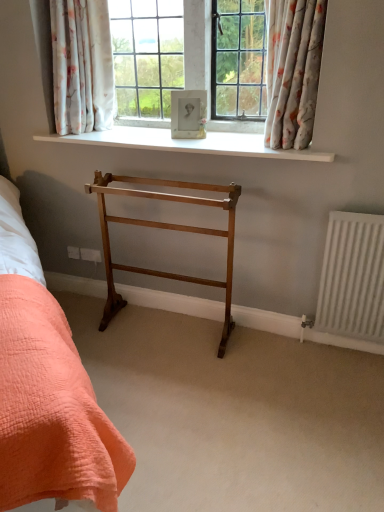
What do you see at coordinates (188, 114) in the screenshot? The width and height of the screenshot is (384, 512). I see `porcelain frame at center` at bounding box center [188, 114].

Locate an element on the screen. This screenshot has height=512, width=384. floral fabric curtain at upper center, positioned as the 2th curtain in right-to-left order is located at coordinates (82, 66).

What do you see at coordinates (168, 229) in the screenshot? This screenshot has height=512, width=384. I see `light brown wood towel rack at center` at bounding box center [168, 229].

The image size is (384, 512). I want to click on porcelain frame at center, so click(x=188, y=114).

At what (x,y) coordinates should I click in order to perform the action: click on picture frame lying above the light brown wood towel rack at center (from the image's perspective). Please return your answer as a coordinate pair (x, y). This screenshot has height=512, width=384. Looking at the image, I should click on (188, 114).

Is point (183, 185) closer to camera compared to point (202, 113)?

Yes, point (183, 185) is in front of point (202, 113).

Would you say light brown wood towel rack at center is inside or outside porcelain frame at center?

light brown wood towel rack at center lies outside porcelain frame at center.

From a real-world perspective, is light brown wood towel rack at center above or below porcelain frame at center?

Clearly, from a real-world perspective, light brown wood towel rack at center is below porcelain frame at center.

Where is `the 2nd curtain above the white matte radiator at right (from the image's perspective)`? The image size is (384, 512). the 2nd curtain above the white matte radiator at right (from the image's perspective) is located at coordinates (82, 66).

Is white matte radiator at right to the right of floral fabric curtain at upper center, positioned as the 2th curtain in right-to-left order, from the viewer's perspective?

Indeed, white matte radiator at right is positioned on the right side of floral fabric curtain at upper center, positioned as the 2th curtain in right-to-left order.

Is white matte radiator at right wider or thinner than floral fabric curtain at upper center, positioned as the 2th curtain in right-to-left order?

white matte radiator at right is thinner than floral fabric curtain at upper center, positioned as the 2th curtain in right-to-left order.

From a real-world perspective, which object stands above the other?

In real-world perspective, porcelain frame at center is above.

In terms of size, does porcelain frame at center appear bigger or smaller than light brown wood towel rack at center?

In the image, porcelain frame at center appears to be smaller than light brown wood towel rack at center.

Which is in front, point (203, 119) or point (98, 179)?

The point (98, 179) is closer to the camera.

Is porcelain frame at center positioned beyond the bounds of light brown wood towel rack at center?

Yes, porcelain frame at center is outside of light brown wood towel rack at center.

From the image's perspective, which object appears higher, light brown wood towel rack at center or white smooth window sill at upper center?

white smooth window sill at upper center appears higher in the image.

Is light brown wood towel rack at center touching white smooth window sill at upper center?

No, light brown wood towel rack at center is not with white smooth window sill at upper center.

Between light brown wood towel rack at center and white smooth window sill at upper center, which one has smaller width?

Thinner between the two is light brown wood towel rack at center.

Is light brown wood towel rack at center positioned beyond the bounds of white smooth window sill at upper center?

Absolutely, light brown wood towel rack at center is external to white smooth window sill at upper center.

Is floral fabric curtain at upper center, positioned as the 2th curtain in right-to-left order, positioned far away from white matte radiator at right?

Indeed, floral fabric curtain at upper center, positioned as the 2th curtain in right-to-left order, is not near white matte radiator at right.

Does floral fabric curtain at upper center, marked as the 1th curtain in a left-to-right arrangement, have a smaller size compared to white matte radiator at right?

No.

In order to click on curtain that is the 2nd object above the white matte radiator at right (from a real-world perspective) in this screenshot , I will do `click(82, 66)`.

Is floral fabric curtain at upper center, positioned as the 2th curtain in right-to-left order, positioned with its back to white matte radiator at right?

No, white matte radiator at right is not at the back of floral fabric curtain at upper center, positioned as the 2th curtain in right-to-left order.

Based on the photo, between light brown wood towel rack at center and floral fabric curtain at upper right, positioned as the 2th curtain in left-to-right order, which one is positioned in front?

floral fabric curtain at upper right, positioned as the 2th curtain in left-to-right order.

Considering the sizes of objects light brown wood towel rack at center and floral fabric curtain at upper right, which is the 1th curtain from right to left, in the image provided, who is bigger, light brown wood towel rack at center or floral fabric curtain at upper right, which is the 1th curtain from right to left,?

With larger size is light brown wood towel rack at center.

From the image's perspective, which is below, light brown wood towel rack at center or floral fabric curtain at upper right, positioned as the 2th curtain in left-to-right order?

light brown wood towel rack at center, from the image's perspective.

What's the angular difference between floral fabric curtain at upper right, which is the 1th curtain from right to left, and white matte radiator at right's facing directions?

The angle between the facing direction of floral fabric curtain at upper right, which is the 1th curtain from right to left, and the facing direction of white matte radiator at right is 0.00144 degrees.

Which object is further away from the camera, floral fabric curtain at upper right, positioned as the 2th curtain in left-to-right order, or white matte radiator at right?

Positioned behind is white matte radiator at right.

Visually, is floral fabric curtain at upper right, positioned as the 2th curtain in left-to-right order, positioned to the left or to the right of white matte radiator at right?

floral fabric curtain at upper right, positioned as the 2th curtain in left-to-right order, is to the left of white matte radiator at right.

I want to click on picture frame located behind the light brown wood towel rack at center, so click(188, 114).

Locate an element on the screen. The width and height of the screenshot is (384, 512). the 2nd curtain to the left of the white matte radiator at right, starting your count from the anchor is located at coordinates (82, 66).

Estimate the real-world distances between objects in this image. Which object is further from porcelain frame at center, white matte radiator at right or floral fabric curtain at upper center, marked as the 1th curtain in a left-to-right arrangement?

white matte radiator at right lies further to porcelain frame at center than the other object.

Estimate the real-world distances between objects in this image. Which object is closer to floral fabric curtain at upper right, positioned as the 2th curtain in left-to-right order, light brown wood towel rack at center or white matte radiator at right?

light brown wood towel rack at center is closer to floral fabric curtain at upper right, positioned as the 2th curtain in left-to-right order.

Which object lies nearer to the anchor point floral fabric curtain at upper right, which is the 1th curtain from right to left, porcelain frame at center or light brown wood towel rack at center?

porcelain frame at center lies closer to floral fabric curtain at upper right, which is the 1th curtain from right to left, than the other object.

Based on their spatial positions, is floral fabric curtain at upper center, marked as the 1th curtain in a left-to-right arrangement, or light brown wood towel rack at center further from white matte radiator at right?

floral fabric curtain at upper center, marked as the 1th curtain in a left-to-right arrangement, lies further to white matte radiator at right than the other object.

When comparing their distances from white matte radiator at right, does porcelain frame at center or white smooth window sill at upper center seem further?

porcelain frame at center.

Looking at the image, which one is located closer to white smooth window sill at upper center, light brown wood towel rack at center or floral fabric curtain at upper right, which is the 1th curtain from right to left?

floral fabric curtain at upper right, which is the 1th curtain from right to left.

Which object lies nearer to the anchor point light brown wood towel rack at center, floral fabric curtain at upper right, positioned as the 2th curtain in left-to-right order, or white matte radiator at right?

floral fabric curtain at upper right, positioned as the 2th curtain in left-to-right order, lies closer to light brown wood towel rack at center than the other object.

From the image, which object appears to be nearer to floral fabric curtain at upper right, which is the 1th curtain from right to left, white smooth window sill at upper center or light brown wood towel rack at center?

Among the two, white smooth window sill at upper center is located nearer to floral fabric curtain at upper right, which is the 1th curtain from right to left.

At what (x,y) coordinates should I click in order to perform the action: click on picture frame situated between white smooth window sill at upper center and floral fabric curtain at upper right, which is the 1th curtain from right to left, from left to right. Please return your answer as a coordinate pair (x, y). The height and width of the screenshot is (512, 384). Looking at the image, I should click on (188, 114).

Where is `picture frame between floral fabric curtain at upper center, positioned as the 2th curtain in right-to-left order, and white matte radiator at right, in the horizontal direction`? picture frame between floral fabric curtain at upper center, positioned as the 2th curtain in right-to-left order, and white matte radiator at right, in the horizontal direction is located at coordinates (188, 114).

Where is `picture frame situated between floral fabric curtain at upper center, marked as the 1th curtain in a left-to-right arrangement, and floral fabric curtain at upper right, which is the 1th curtain from right to left, from left to right`? This screenshot has width=384, height=512. picture frame situated between floral fabric curtain at upper center, marked as the 1th curtain in a left-to-right arrangement, and floral fabric curtain at upper right, which is the 1th curtain from right to left, from left to right is located at coordinates (188, 114).

The height and width of the screenshot is (512, 384). In order to click on window sill between floral fabric curtain at upper center, positioned as the 2th curtain in right-to-left order, and white matte radiator at right in this screenshot , I will do `click(188, 143)`.